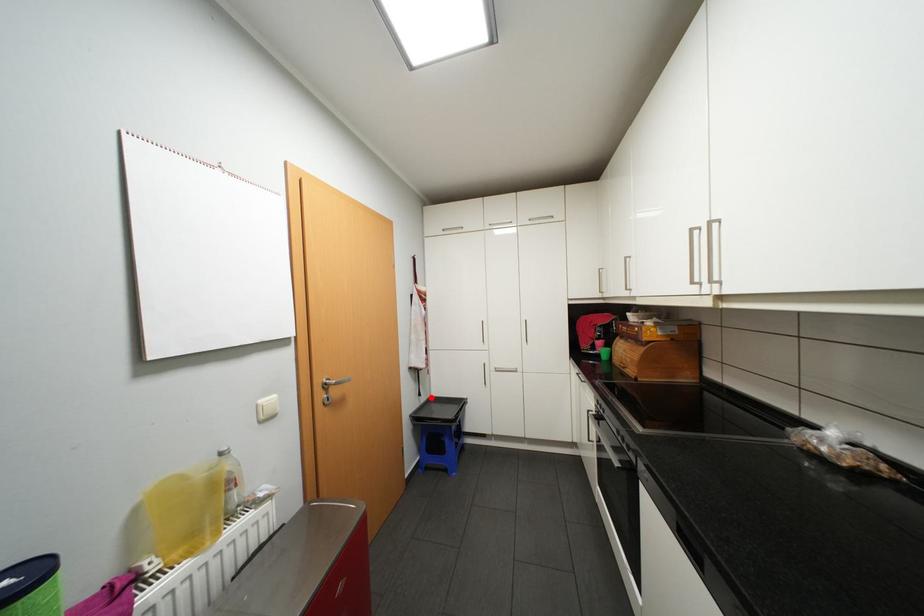
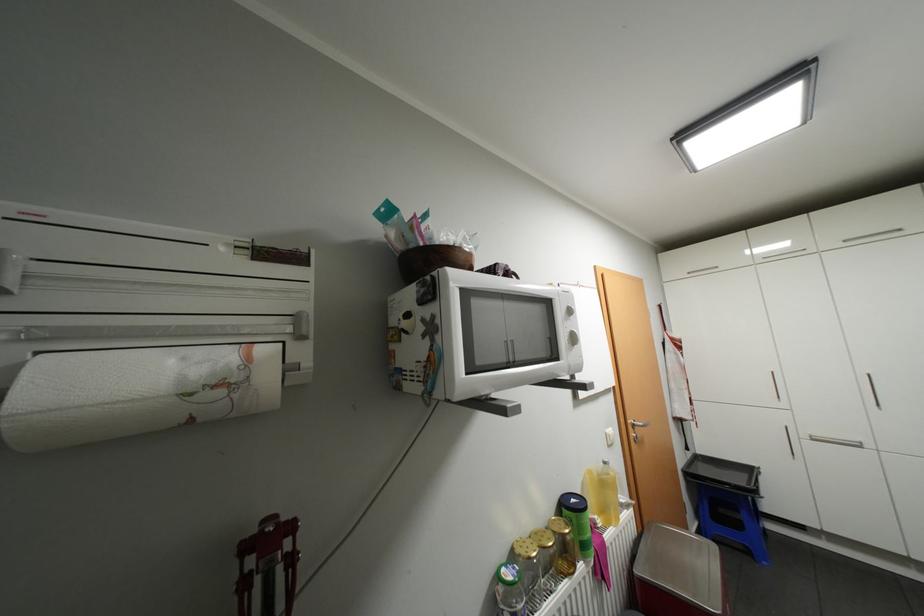
In the second image, find the point that corresponds to the highlighted location in the first image.

(697, 453)